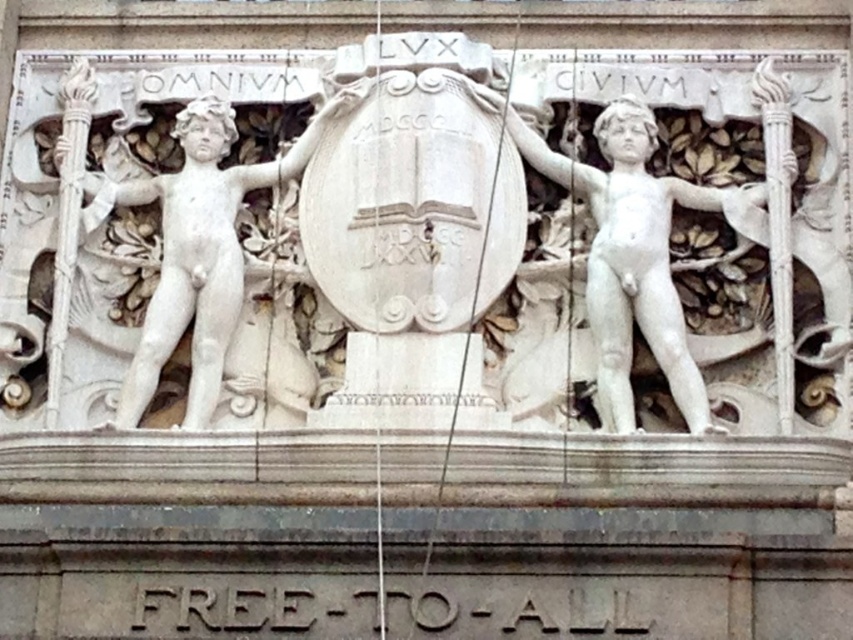
Question: Does white marble statue at right come in front of white marble statue at left?

Choices:
 (A) yes
 (B) no

Answer: (A)

Question: Can you confirm if white marble statue at right is positioned below white marble statue at left?

Choices:
 (A) no
 (B) yes

Answer: (A)

Question: Which object is farther from the camera taking this photo?

Choices:
 (A) white marble statue at left
 (B) white marble statue at right

Answer: (A)

Question: In this image, where is white marble statue at right located relative to white marble statue at left?

Choices:
 (A) above
 (B) below

Answer: (A)